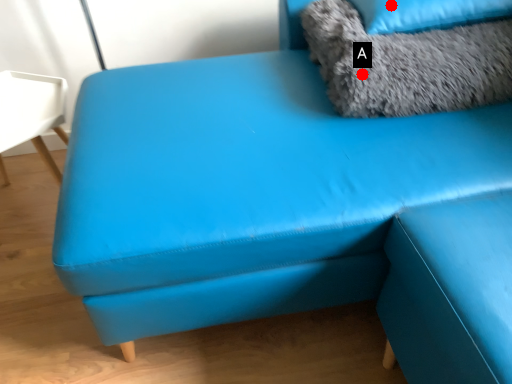
Question: Two points are circled on the image, labeled by A and B beside each circle. Among these points, which one is nearest to the camera?

Choices:
 (A) A is closer
 (B) B is closer

Answer: (A)